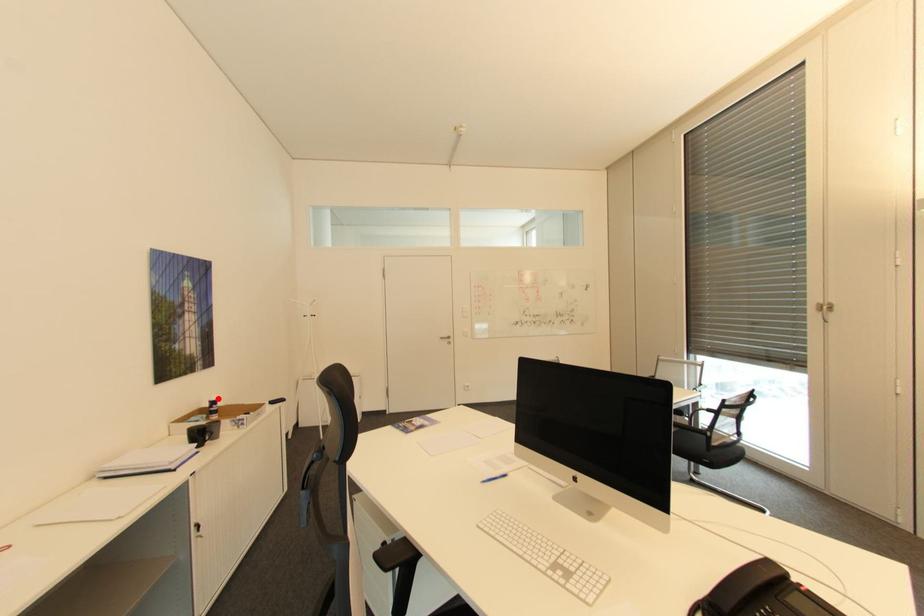
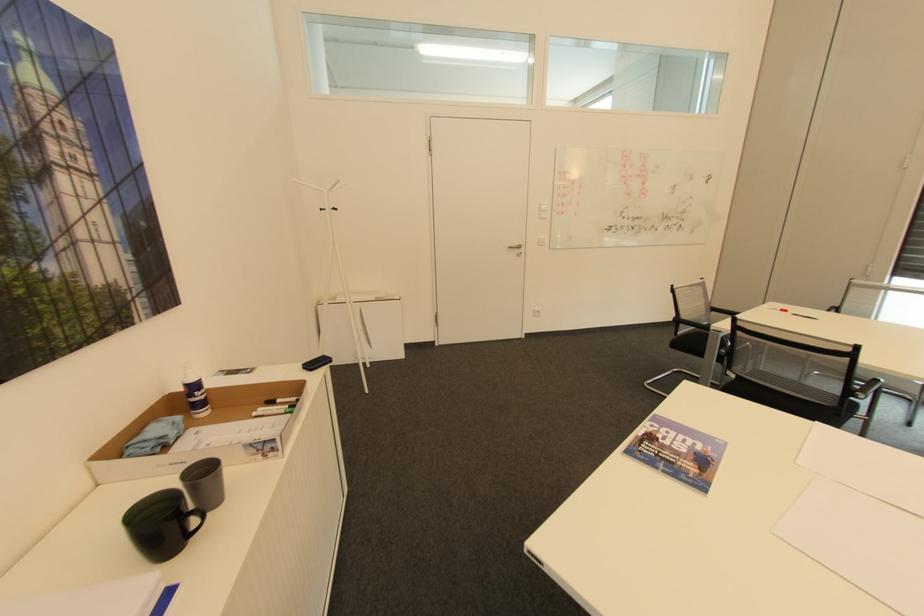
Question: I am providing you with two images of the same scene from different viewpoints. A red point is marked on the first image. At the location where the point appears in image 1, is it still visible in image 2?

Choices:
 (A) Yes
 (B) No

Answer: (A)